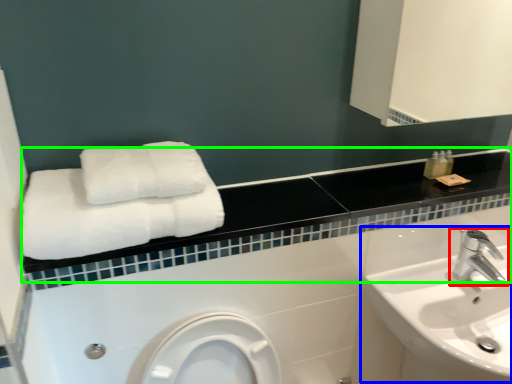
Question: Estimate the real-world distances between objects in this image. Which object is farther from tap (highlighted by a red box), sink (highlighted by a blue box) or balustrade (highlighted by a green box)?

Choices:
 (A) sink
 (B) balustrade

Answer: (B)